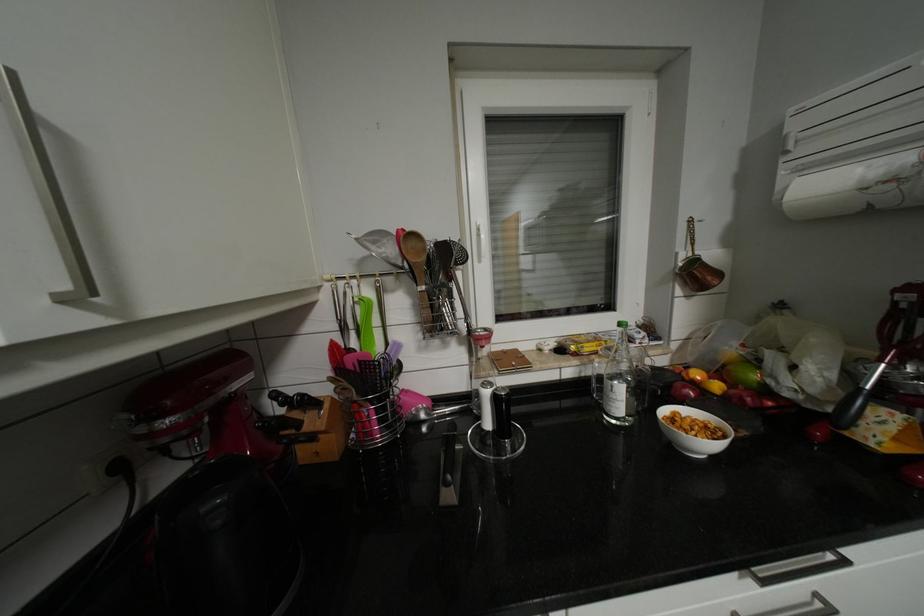
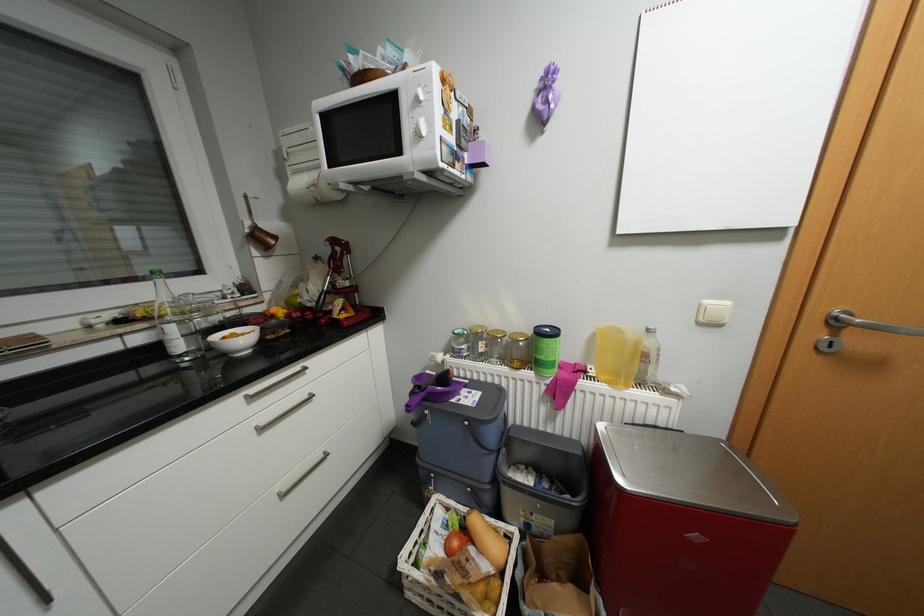
Find the pixel in the second image that matches (x=548, y=349) in the first image.

(96, 326)